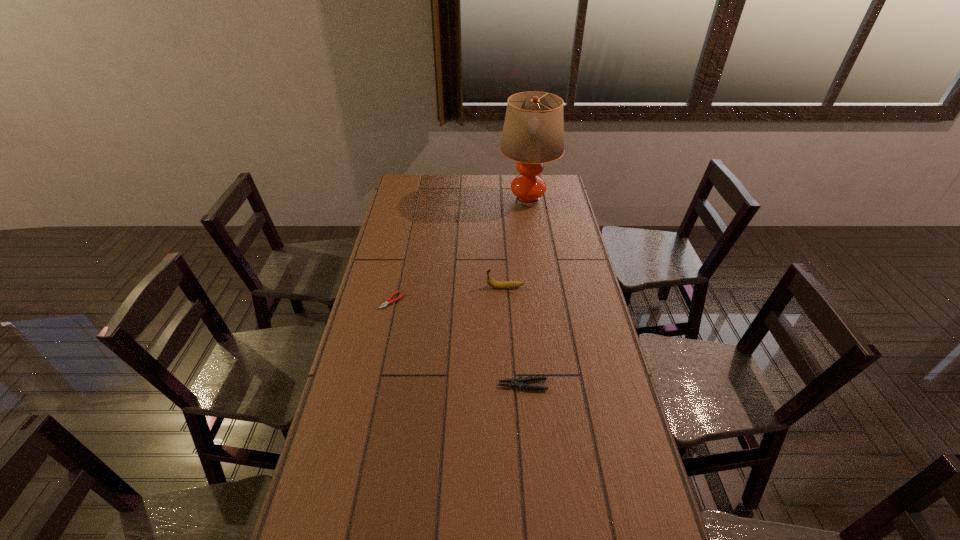
Image resolution: width=960 pixels, height=540 pixels. In order to click on blank area located 0.250m at the stem of the third nearest object in this screenshot , I will do `click(421, 287)`.

Where is `vacant space located 0.080m at the stem of the third nearest object`? This screenshot has height=540, width=960. vacant space located 0.080m at the stem of the third nearest object is located at coordinates (x=466, y=287).

You are a GUI agent. You are given a task and a screenshot of the screen. Output one action in this format:
    pyautogui.click(x=<x>, y=<y>)
    Task: Click on the free region located 0.090m at the gripping part of the third tallest object
    
    Given the screenshot: What is the action you would take?
    pyautogui.click(x=470, y=385)

You are a GUI agent. You are given a task and a screenshot of the screen. Output one action in this format:
    pyautogui.click(x=<x>, y=<y>)
    Task: Click on the vacant space located at the gripping part of the third tallest object
    
    Given the screenshot: What is the action you would take?
    pyautogui.click(x=447, y=385)

You are a GUI agent. You are given a task and a screenshot of the screen. Output one action in this format:
    pyautogui.click(x=<x>, y=<y>)
    Task: Click on the free spot located at the gripping part of the third tallest object
    This screenshot has height=540, width=960.
    Given the screenshot: What is the action you would take?
    pyautogui.click(x=447, y=385)

Locate an element on the screen. free location located 0.050m on the right of the leftmost object is located at coordinates (417, 300).

Locate an element on the screen. The height and width of the screenshot is (540, 960). object located at the far edge is located at coordinates (533, 133).

This screenshot has height=540, width=960. I want to click on object present at the left edge, so click(x=388, y=301).

This screenshot has width=960, height=540. Find the location of `object that is at the right edge`. object that is at the right edge is located at coordinates (533, 133).

At what (x,y) coordinates should I click in order to perform the action: click on object at the far right corner. Please return your answer as a coordinate pair (x, y). The image size is (960, 540). Looking at the image, I should click on (533, 133).